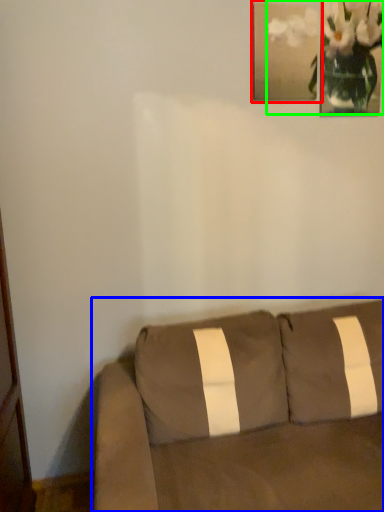
Question: Estimate the real-world distances between objects in this image. Which object is farther from picture frame (highlighted by a red box), studio couch (highlighted by a blue box) or floral arrangement (highlighted by a green box)?

Choices:
 (A) studio couch
 (B) floral arrangement

Answer: (A)